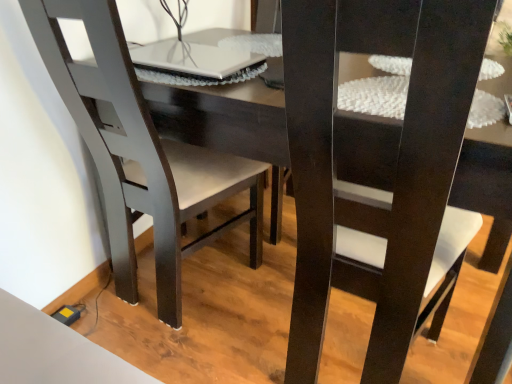
Question: Is matte black chair at left, which is the 2th chair from right to left, at the back of matte black chair at center, which is counted as the 1th chair, starting from the right?

Choices:
 (A) yes
 (B) no

Answer: (B)

Question: Is matte black chair at center, which is counted as the 1th chair, starting from the right, facing towards matte black chair at left, which is the 2th chair from right to left?

Choices:
 (A) yes
 (B) no

Answer: (B)

Question: From the image's perspective, would you say matte black chair at center, which is counted as the 1th chair, starting from the right, is positioned over matte black chair at left, which is the 2th chair from right to left?

Choices:
 (A) yes
 (B) no

Answer: (B)

Question: From a real-world perspective, is matte black chair at center, the 2th chair positioned from the left, under matte black chair at left, the first chair when ordered from left to right?

Choices:
 (A) yes
 (B) no

Answer: (B)

Question: Would you say matte black chair at center, which is counted as the 1th chair, starting from the right, is outside matte black chair at left, the first chair when ordered from left to right?

Choices:
 (A) yes
 (B) no

Answer: (A)

Question: Looking at the image, does white glossy laptop at upper center seem bigger or smaller compared to matte black chair at center, which is counted as the 1th chair, starting from the right?

Choices:
 (A) small
 (B) big

Answer: (A)

Question: In terms of width, does white glossy laptop at upper center look wider or thinner when compared to matte black chair at center, which is counted as the 1th chair, starting from the right?

Choices:
 (A) wide
 (B) thin

Answer: (B)

Question: Relative to matte black chair at center, which is counted as the 1th chair, starting from the right, is white glossy laptop at upper center in front or behind?

Choices:
 (A) front
 (B) behind

Answer: (B)

Question: Is white glossy laptop at upper center to the left or to the right of matte black chair at center, which is counted as the 1th chair, starting from the right, in the image?

Choices:
 (A) left
 (B) right

Answer: (A)

Question: From their relative heights in the image, would you say matte black chair at center, which is counted as the 1th chair, starting from the right, is taller or shorter than white glossy laptop at upper center?

Choices:
 (A) tall
 (B) short

Answer: (A)

Question: Is matte black chair at center, the 2th chair positioned from the left, inside or outside of white glossy laptop at upper center?

Choices:
 (A) outside
 (B) inside

Answer: (A)

Question: Is matte black chair at center, which is counted as the 1th chair, starting from the right, wider or thinner than white glossy laptop at upper center?

Choices:
 (A) wide
 (B) thin

Answer: (A)

Question: From a real-world perspective, is matte black chair at center, which is counted as the 1th chair, starting from the right, physically located above or below white glossy laptop at upper center?

Choices:
 (A) below
 (B) above

Answer: (A)

Question: Considering the positions of matte black chair at center, which is counted as the 1th chair, starting from the right, and matte black chair at left, the first chair when ordered from left to right, in the image, is matte black chair at center, which is counted as the 1th chair, starting from the right, bigger or smaller than matte black chair at left, the first chair when ordered from left to right,?

Choices:
 (A) big
 (B) small

Answer: (A)

Question: Is matte black chair at center, the 2th chair positioned from the left, taller or shorter than matte black chair at left, which is the 2th chair from right to left?

Choices:
 (A) short
 (B) tall

Answer: (B)